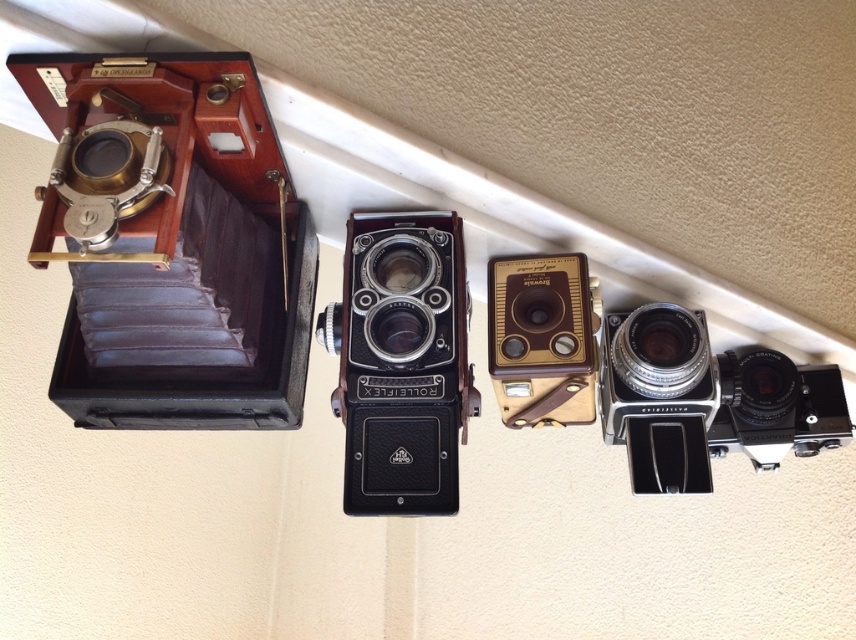
Which camera is wider between the black matte rolleiflex at center and the gold metallic camera at center?

The black matte rolleiflex at center is wider than the gold metallic camera at center according to the description.

Which camera is bigger between the black matte rolleiflex at center and the gold metallic camera at center?

The black matte rolleiflex at center is larger in size than the gold metallic camera at center.